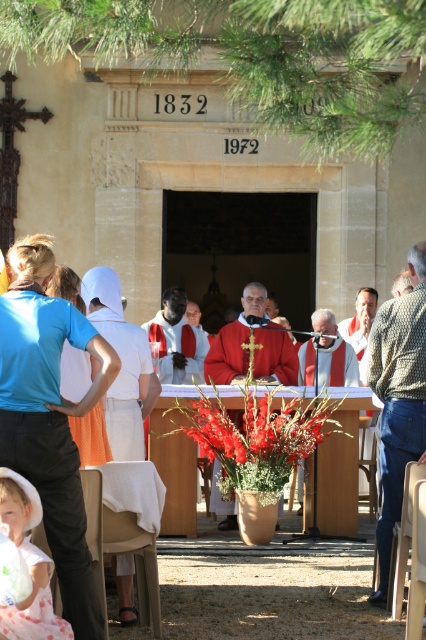
Question: Is white satin robe at center positioned before matte red vest at center?

Choices:
 (A) no
 (B) yes

Answer: (B)

Question: Among these points, which one is nearest to the camera?

Choices:
 (A) 400,433
 (B) 192,305
 (C) 242,436
 (D) 43,602

Answer: (D)

Question: Is smooth white robe at center smaller than matte red vest at center?

Choices:
 (A) yes
 (B) no

Answer: (B)

Question: Can you confirm if matte blue shirt at left is positioned to the left of blue fabric shirt at left?

Choices:
 (A) yes
 (B) no

Answer: (B)

Question: Among these points, which one is nearest to the camera?

Choices:
 (A) coord(198,308)
 (B) coord(388,502)

Answer: (B)

Question: Which of the following is the farthest from the observer?

Choices:
 (A) pos(204,333)
 (B) pos(175,308)
 (C) pos(209,426)

Answer: (A)